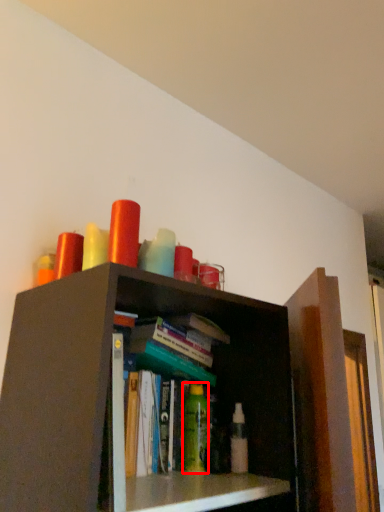
Question: From the image's perspective, where is toiletry (annotated by the red box) located in relation to toiletry in the image?

Choices:
 (A) below
 (B) above

Answer: (B)